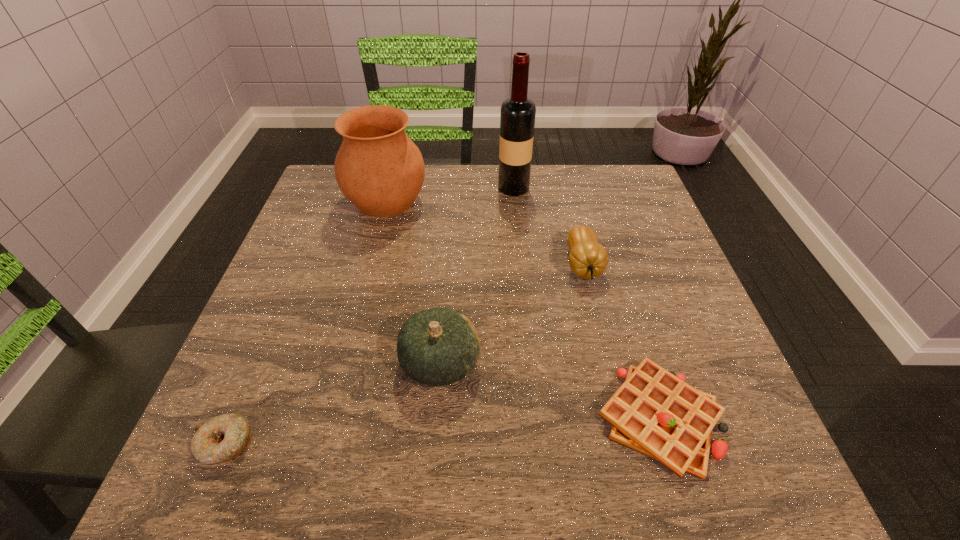
This screenshot has height=540, width=960. In the image, there is a desktop. Find the location of `free region at the far right corner`. free region at the far right corner is located at coordinates tap(623, 203).

Locate an element on the screen. free space between the doughnut and the fourth shortest object is located at coordinates (333, 403).

Locate an element on the screen. unoccupied area between the doughnut and the pottery is located at coordinates (305, 322).

At what (x,y) coordinates should I click in order to perform the action: click on free spot between the leftmost object and the fifth tallest object. Please return your answer as a coordinate pair (x, y). Looking at the image, I should click on (442, 431).

In order to click on empty space between the tallest object and the farther gourd in this screenshot , I will do `click(548, 226)`.

Identify the location of unoccupied area between the doughnut and the pottery. This screenshot has height=540, width=960. (305, 322).

Image resolution: width=960 pixels, height=540 pixels. In order to click on vacant area that lies between the taller gourd and the right gourd in this screenshot , I will do `click(512, 314)`.

Find the location of a particular element. This screenshot has height=540, width=960. unoccupied position between the waffle and the shorter gourd is located at coordinates (620, 342).

This screenshot has width=960, height=540. In order to click on vacant region between the fifth shortest object and the waffle in this screenshot , I will do `click(522, 309)`.

You are a GUI agent. You are given a task and a screenshot of the screen. Output one action in this format:
    pyautogui.click(x=<x>, y=<y>)
    Task: Click on the empty location between the shortest object and the left gourd
    The height and width of the screenshot is (540, 960).
    Given the screenshot: What is the action you would take?
    pyautogui.click(x=333, y=403)